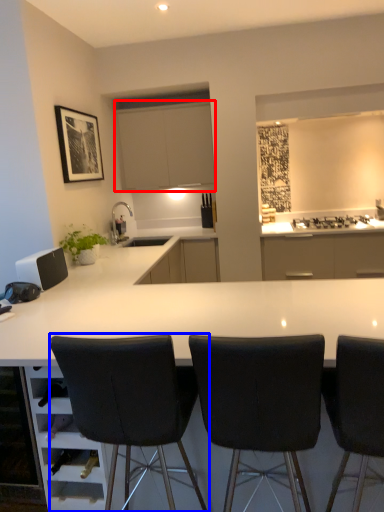
Question: Which point is closer to the camera, cabinetry (highlighted by a red box) or chair (highlighted by a blue box)?

Choices:
 (A) cabinetry
 (B) chair

Answer: (B)